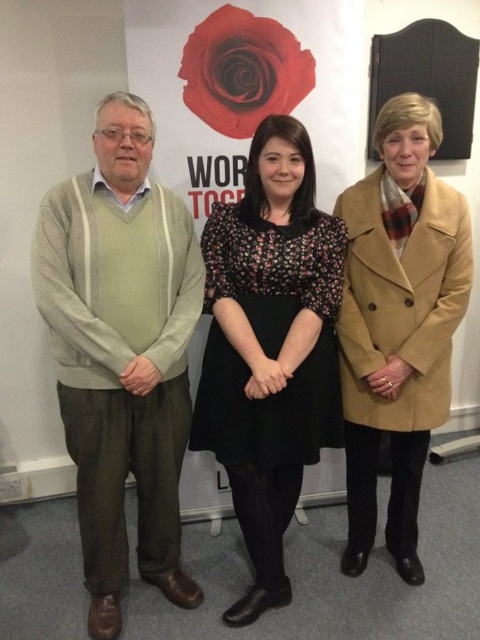
In the scene shown: Is light beige sweater at left to the right of tan wool coat at center from the viewer's perspective?

Incorrect, light beige sweater at left is not on the right side of tan wool coat at center.

Does light beige sweater at left have a larger size compared to tan wool coat at center?

Incorrect, light beige sweater at left is not larger than tan wool coat at center.

The width and height of the screenshot is (480, 640). I want to click on light beige sweater at left, so click(121, 353).

Does light beige sweater at left have a greater height compared to floral-patterned dress at center?

Indeed, light beige sweater at left has a greater height compared to floral-patterned dress at center.

Between light beige sweater at left and floral-patterned dress at center, which one has more height?

With more height is light beige sweater at left.

Does point (61, 390) come closer to viewer compared to point (233, 204)?

That is True.

Locate an element on the screen. This screenshot has width=480, height=640. light beige sweater at left is located at coordinates (121, 353).

Can you confirm if floral-patterned dress at center is positioned to the left of tan wool coat at center?

Indeed, floral-patterned dress at center is positioned on the left side of tan wool coat at center.

Does floral-patterned dress at center have a lesser width compared to tan wool coat at center?

Incorrect, floral-patterned dress at center's width is not less than tan wool coat at center's.

Who is more forward, (240, 285) or (381, 144)?

Point (381, 144) is more forward.

The height and width of the screenshot is (640, 480). I want to click on floral-patterned dress at center, so click(269, 348).